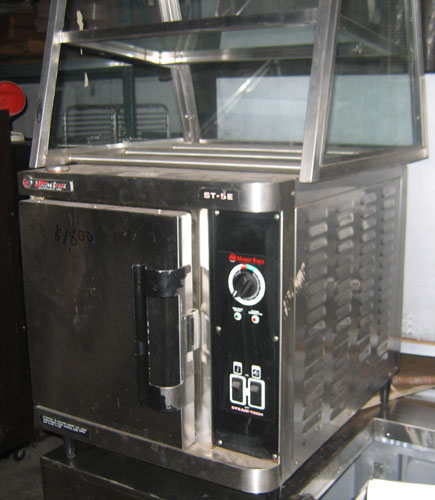
Where is `black knob`? black knob is located at coordinates (241, 285).